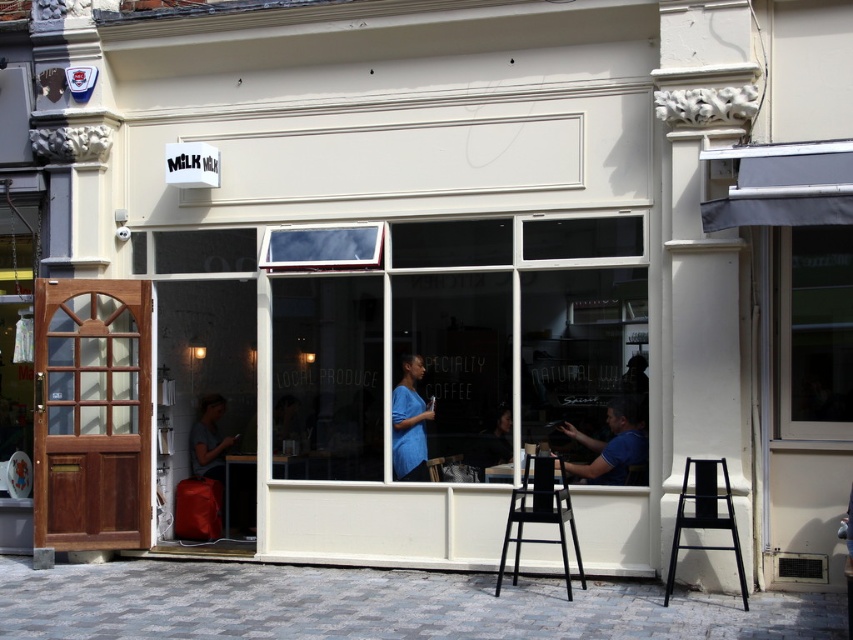
You are designing a layout for a new cafe and want to place a blue matte shirt at center and a black plastic bar stool at center. Given their sizes, which object should be placed first to ensure proper spacing?

The black plastic bar stool at center is larger in size than the blue matte shirt at center, so it should be placed first to ensure proper spacing.

You are standing at the entrance of the Milk cafe and want to move towards the back of the store. Which point, point 1 at coordinates [555,516] or point 2 at coordinates [408,381], is closer to your current position?

Point 1 at coordinates [555,516] is closer to the viewer than point 2 at coordinates [408,381], so it is closer to your current position at the entrance.

You are a customer who wants to sit down at the nearest available seat in the cafe. There is a black plastic bar stool at center at point (540, 515). Is there any other seat closer to you than the black plastic bar stool at center?

The black plastic bar stool at center at point (540, 515) is the closest seat available.